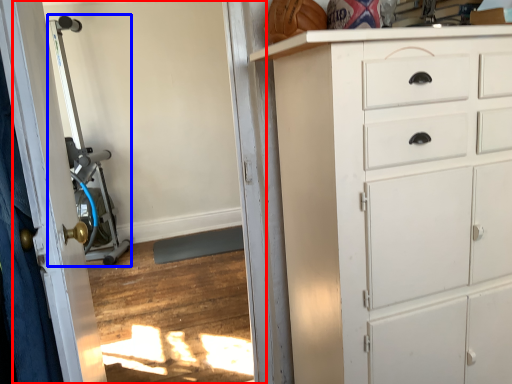
Question: Which point is further to the camera, screen door (highlighted by a red box) or sport equipment (highlighted by a blue box)?

Choices:
 (A) screen door
 (B) sport equipment

Answer: (B)